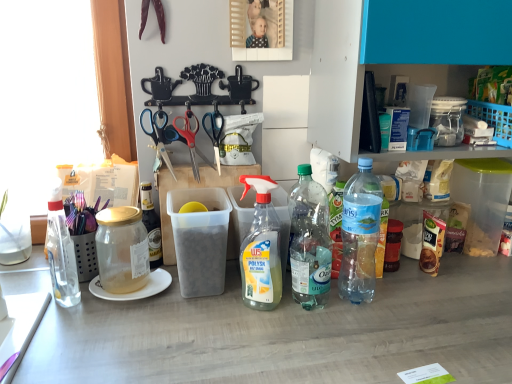
Locate an element on the screen. The width and height of the screenshot is (512, 384). free point above white ceramic plate at left (from a real-world perspective) is located at coordinates (130, 279).